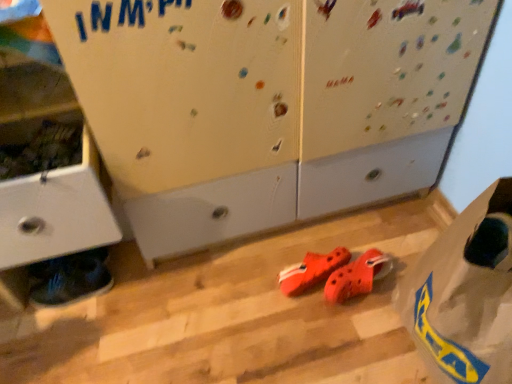
I want to click on free space in front of shiny blue sneakers at lower left, positioned as the 1th footwear in left-to-right order, so click(x=67, y=338).